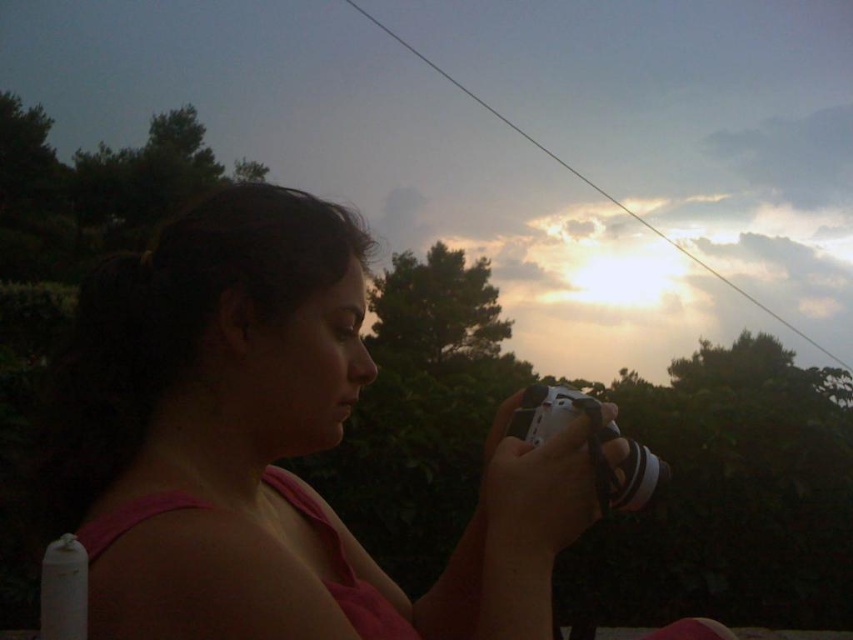
Can you confirm if pink fabric at center is positioned to the left of white plastic camera at center?

Indeed, pink fabric at center is positioned on the left side of white plastic camera at center.

Who is more distant from viewer, [332,230] or [590,403]?

The point [332,230] is behind.

Locate an element on the screen. pink fabric at center is located at coordinates (267, 445).